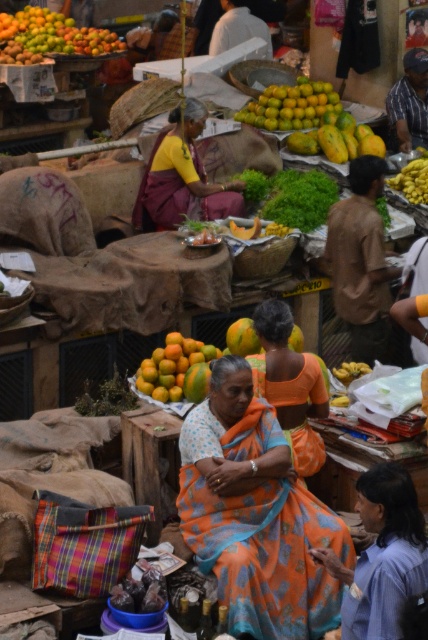
Does shiny orange fruits at upper left have a smaller size compared to orange matte at center?

No, shiny orange fruits at upper left is not smaller than orange matte at center.

Does shiny orange fruits at upper left appear under orange matte at center?

Incorrect, shiny orange fruits at upper left is not positioned below orange matte at center.

Image resolution: width=428 pixels, height=640 pixels. I want to click on shiny orange fruits at upper left, so click(53, 35).

Who is more forward, (323,220) or (299,96)?

Point (323,220) is in front.

Can you confirm if green leafy at center is thinner than shiny orange oranges at center?

Yes.

Where is `green leafy at center`? The image size is (428, 640). green leafy at center is located at coordinates (291, 196).

Can you confirm if orange fabric saree at center is positioned above orange matte at center?

No, orange fabric saree at center is not above orange matte at center.

Is point (293, 428) positioned before point (146, 369)?

That is True.

Is point (326, 413) in front of point (171, 340)?

Yes, it is in front of point (171, 340).

Identify the location of orange fabric saree at center. (290, 385).